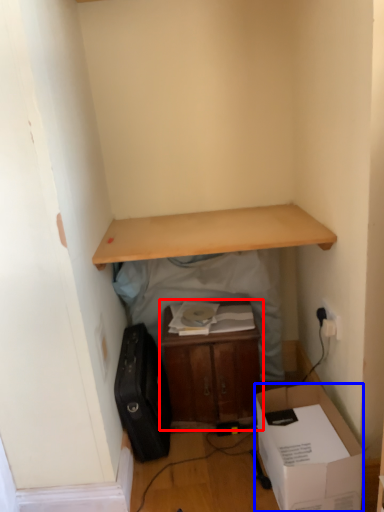
Question: Which point is closer to the camera, table (highlighted by a red box) or box (highlighted by a blue box)?

Choices:
 (A) table
 (B) box

Answer: (B)